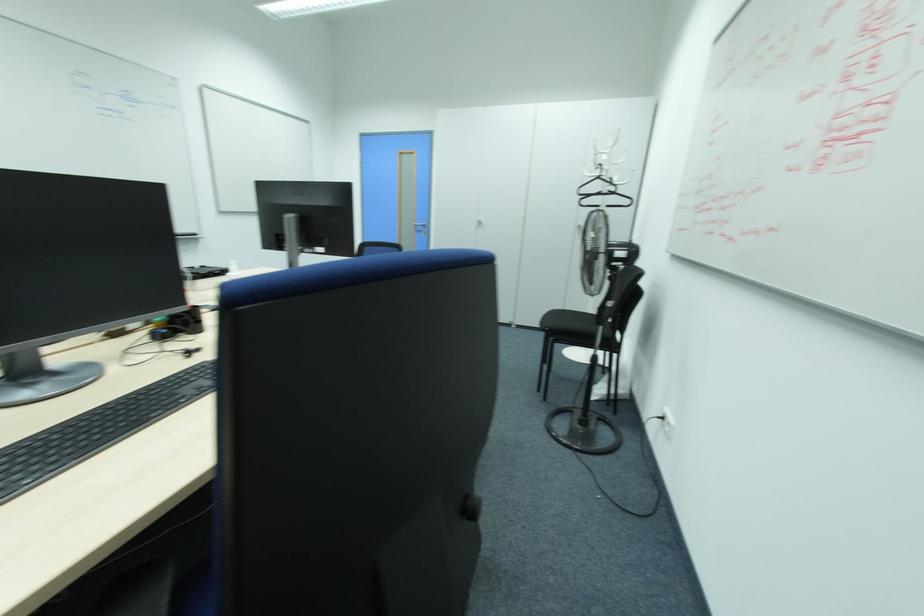
The image size is (924, 616). Describe the element at coordinates (479, 224) in the screenshot. I see `the white cabinet handle` at that location.